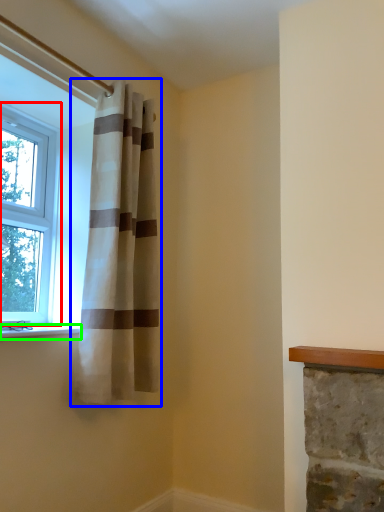
Question: Considering the real-world distances, which object is farthest from window (highlighted by a red box)? curtain (highlighted by a blue box) or window sill (highlighted by a green box)?

Choices:
 (A) curtain
 (B) window sill

Answer: (B)